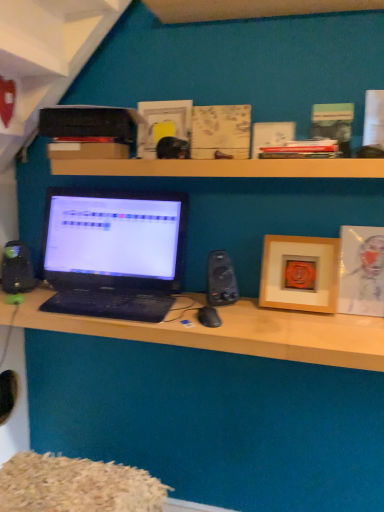
At what (x,y) coordinates should I click in order to perform the action: click on free space in front of black matte mouse at center. Please return your answer as a coordinate pair (x, y). The image size is (384, 512). Looking at the image, I should click on (212, 333).